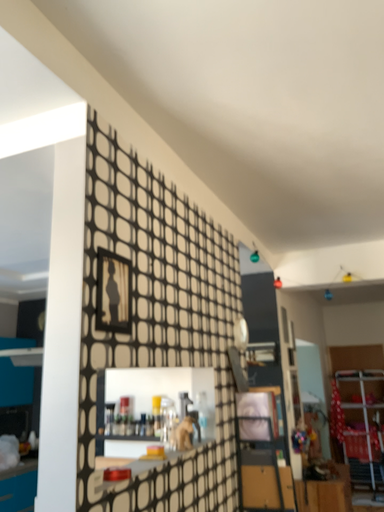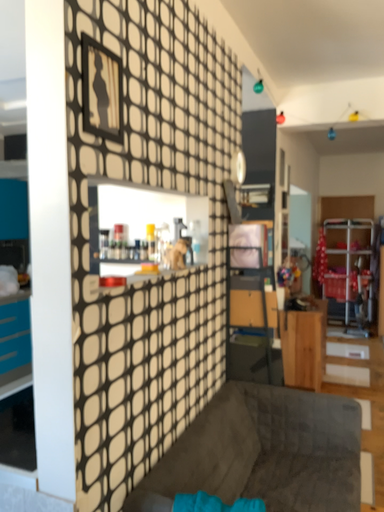
Question: Which way did the camera rotate in the video?

Choices:
 (A) rotated upward
 (B) rotated downward

Answer: (B)